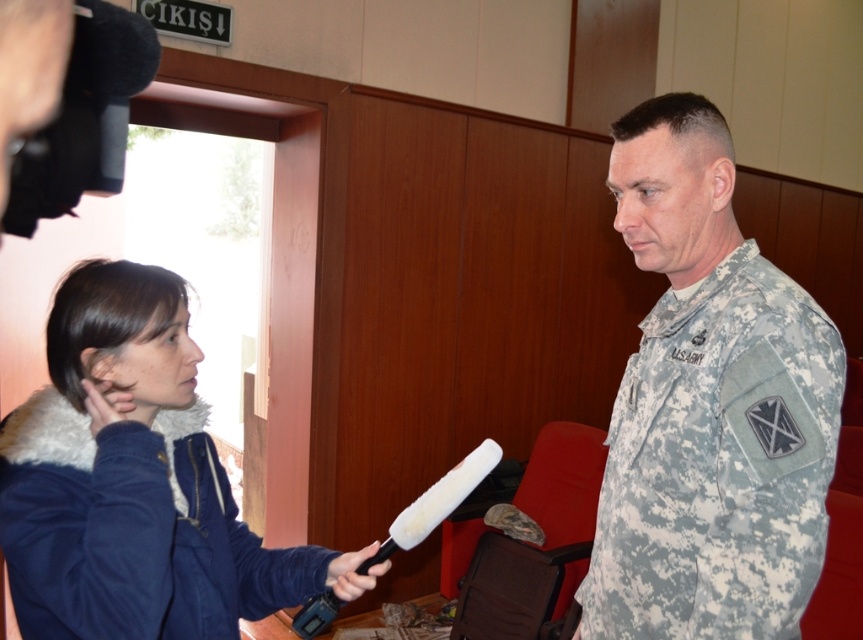
Can you confirm if camouflage fabric uniform at center is smaller than navy blue fleece jacket at lower left?

No, camouflage fabric uniform at center is not smaller than navy blue fleece jacket at lower left.

Is camouflage fabric uniform at center closer to camera compared to navy blue fleece jacket at lower left?

That is False.

This screenshot has height=640, width=863. What are the coordinates of `camouflage fabric uniform at center` in the screenshot? It's located at (709, 406).

Locate an element on the screen. camouflage fabric uniform at center is located at coordinates (709, 406).

Between navy blue fleece jacket at lower left and black rubber microphone at center, which one has more height?

navy blue fleece jacket at lower left

Image resolution: width=863 pixels, height=640 pixels. What do you see at coordinates (131, 531) in the screenshot? I see `navy blue fleece jacket at lower left` at bounding box center [131, 531].

In order to click on navy blue fleece jacket at lower left in this screenshot , I will do `click(131, 531)`.

Is camouflage fabric uniform at center wider than black rubber microphone at center?

Yes.

Between camouflage fabric uniform at center and black rubber microphone at center, which one is positioned higher?

camouflage fabric uniform at center is above.

Who is more forward, (x=672, y=540) or (x=326, y=570)?

Point (x=672, y=540) is in front.

You are a GUI agent. You are given a task and a screenshot of the screen. Output one action in this format:
    pyautogui.click(x=<x>, y=<y>)
    Task: Click on the camouflage fabric uniform at center
    Image resolution: width=863 pixels, height=640 pixels.
    Given the screenshot: What is the action you would take?
    pyautogui.click(x=709, y=406)